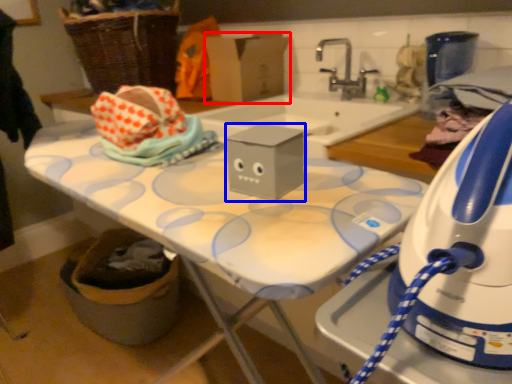
Question: Which object appears farthest to the camera in this image, cardboard box (highlighted by a red box) or box (highlighted by a blue box)?

Choices:
 (A) cardboard box
 (B) box

Answer: (A)